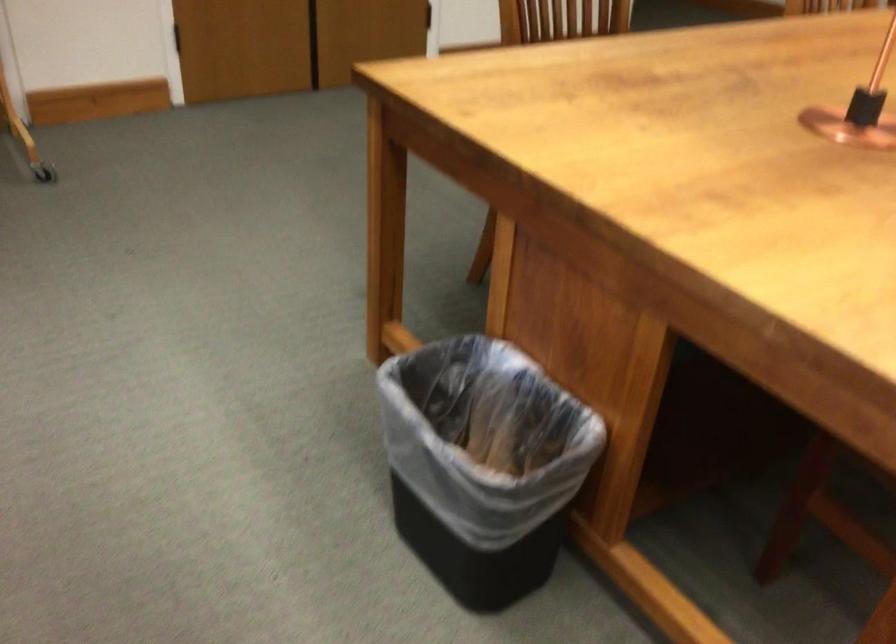
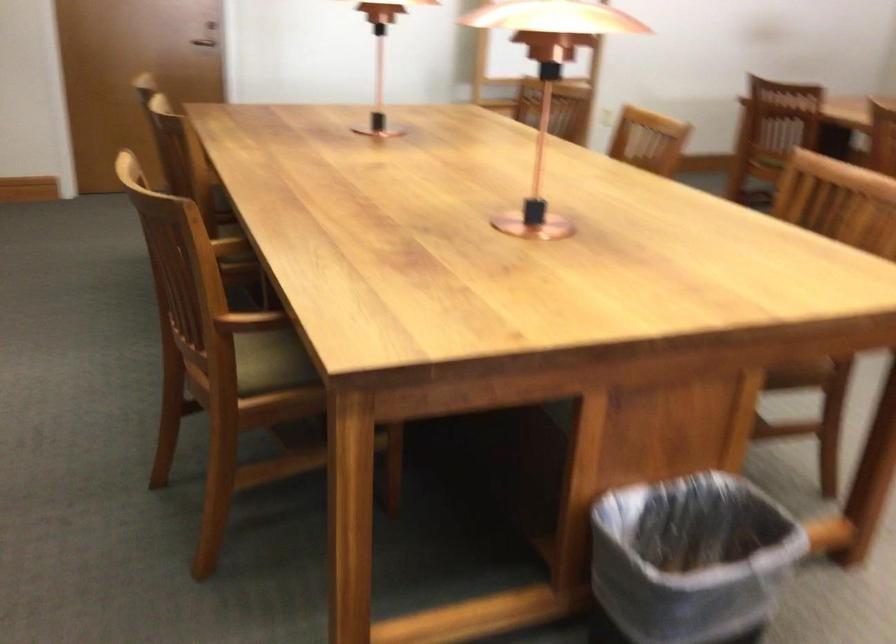
In the second image, find the point that corresponds to point (558, 496) in the first image.

(691, 560)